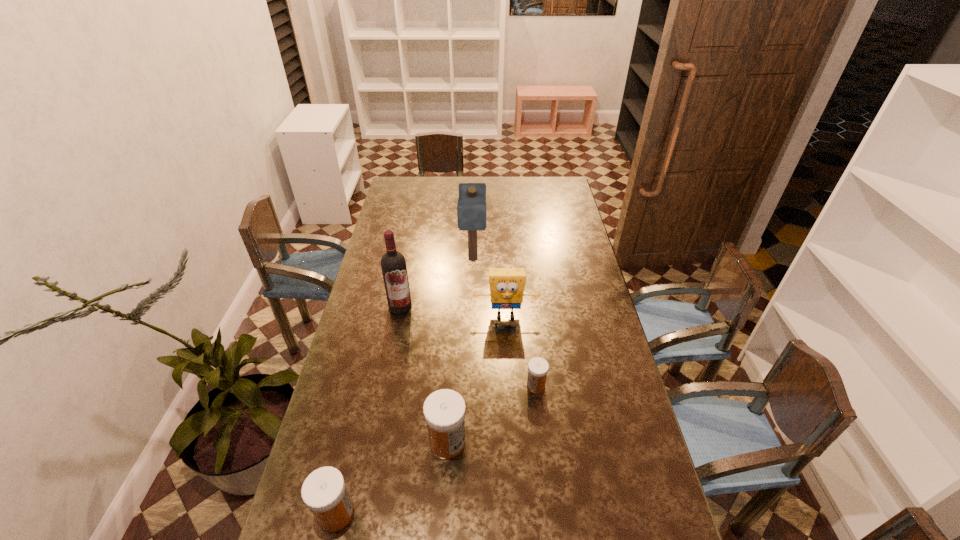
Please point a spot to add another medicine on the right. Please provide its 2D coordinates. Your answer should be formatted as a tuple, i.e. [(x, y)], where the tuple contains the x and y coordinates of a point satisfying the conditions above.

[(608, 339)]